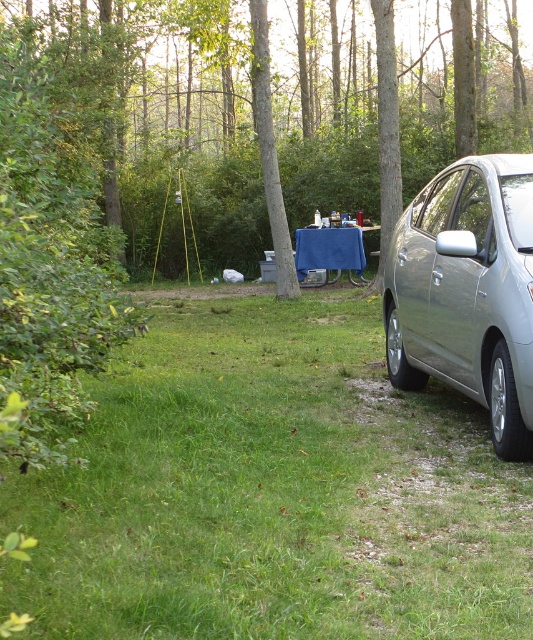
Does green grass at lower left have a larger size compared to green leafy tree at center?

Actually, green grass at lower left might be smaller than green leafy tree at center.

Can you confirm if green grass at lower left is shorter than green leafy tree at center?

Correct, green grass at lower left is not as tall as green leafy tree at center.

Locate an element on the screen. The image size is (533, 640). green grass at lower left is located at coordinates (273, 493).

What are the coordinates of `green grass at lower left` in the screenshot? It's located at (273, 493).

Between green grass at lower left and blue fabric picnic table at center, which one has less height?

With less height is green grass at lower left.

Is point (189, 515) in front of point (351, 244)?

Yes, point (189, 515) is in front of point (351, 244).

Who is more distant from viewer, (x=443, y=428) or (x=327, y=236)?

Point (x=327, y=236)

Locate an element on the screen. This screenshot has height=640, width=533. green grass at lower left is located at coordinates (273, 493).

Does point (297, 598) come in front of point (434, 214)?

Yes, point (297, 598) is closer to viewer.

Does green grass at lower left appear on the left side of silver metallic car at right?

Correct, you'll find green grass at lower left to the left of silver metallic car at right.

Is point (314, 600) less distant than point (454, 234)?

Yes, it is in front of point (454, 234).

This screenshot has height=640, width=533. Find the location of `green grass at lower left`. green grass at lower left is located at coordinates (273, 493).